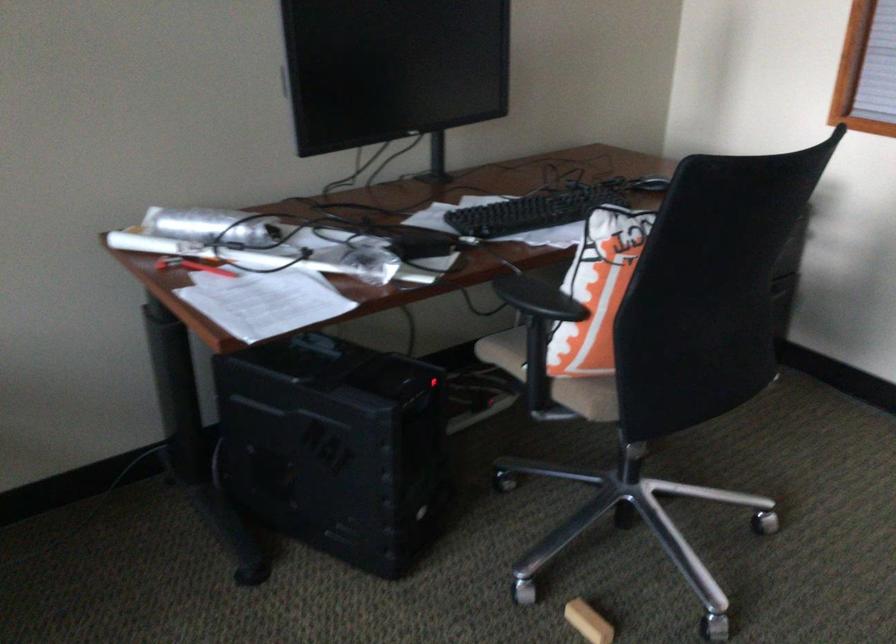
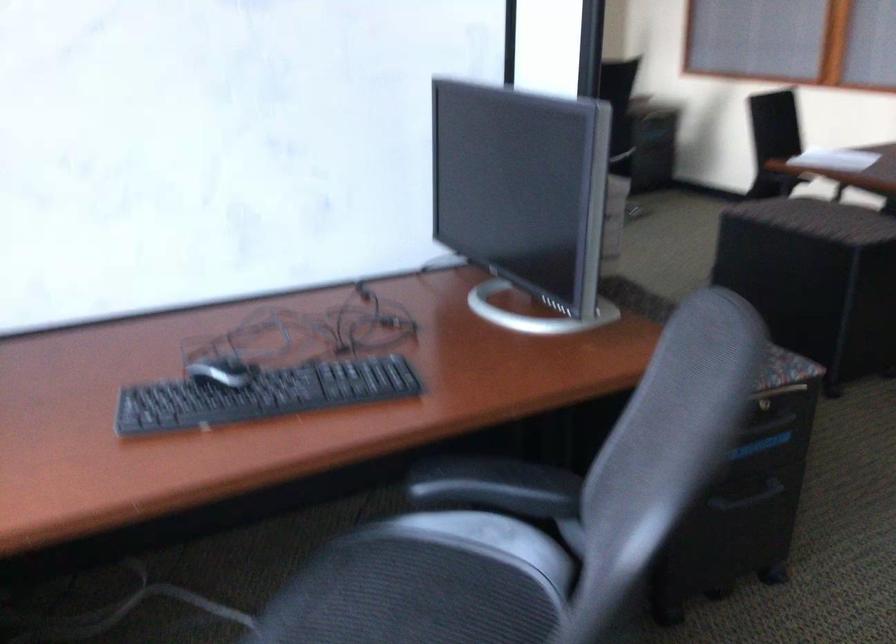
Question: I am providing you with two images of the same scene from different viewpoints. Please identify which objects are invisible in image2.

Choices:
 (A) beige chair sitting surface
 (B) black chair armrest
 (C) cabinet drawer handle
 (D) gold-cased caster wheel

Answer: (A)